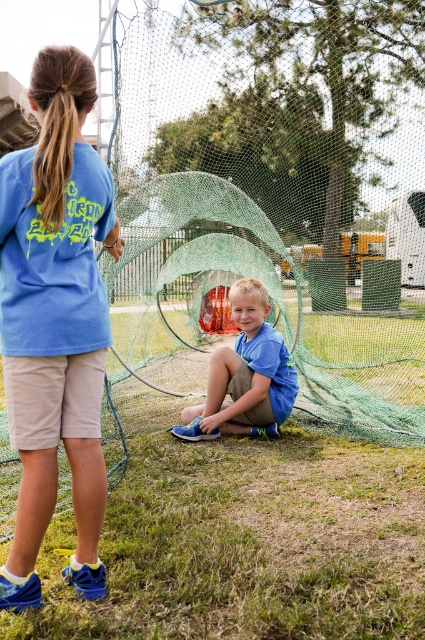
Question: Which point is closer to the camera?

Choices:
 (A) (181, 436)
 (B) (99, 161)

Answer: (B)

Question: Among these objects, which one is nearest to the camera?

Choices:
 (A) green mesh fishing net at center
 (B) blue cotton shirt at center
 (C) blue cotton shirt at upper left

Answer: (C)

Question: In this image, where is blue cotton shirt at upper left located relative to blue cotton shirt at center?

Choices:
 (A) above
 (B) below

Answer: (A)

Question: Among these points, which one is nearest to the camera?

Choices:
 (A) (235, 273)
 (B) (28, 525)
 (C) (280, 396)

Answer: (B)

Question: Is green mesh fishing net at center bigger than blue cotton shirt at upper left?

Choices:
 (A) yes
 (B) no

Answer: (A)

Question: Does blue cotton shirt at upper left have a greater width compared to blue cotton shirt at center?

Choices:
 (A) yes
 (B) no

Answer: (B)